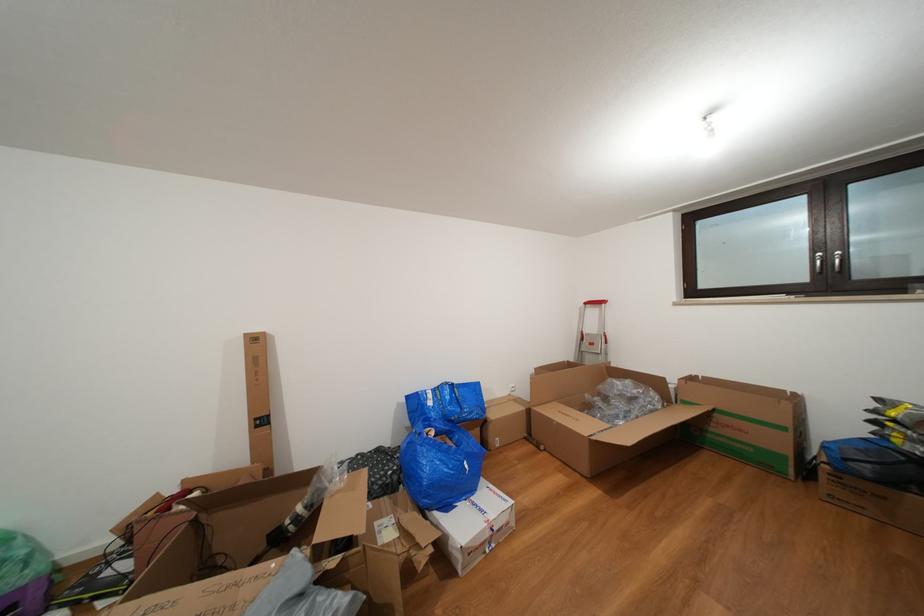
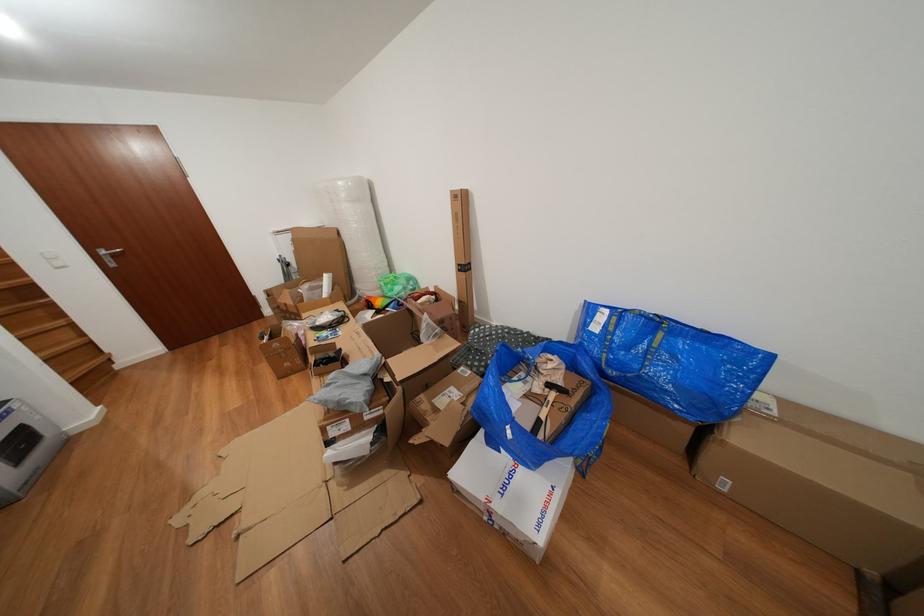
Where in the second image is the point corresponding to point (265, 432) from the first image?

(468, 276)